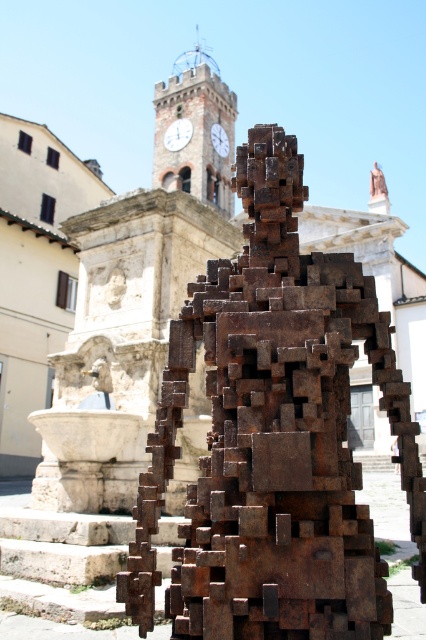
At what (x,y) coordinates should I click in order to perform the action: click on rusty metal sculpture at center. Please return your answer as a coordinate pair (x, y). Looking at the image, I should click on (273, 435).

Between point (423, 520) and point (166, 145), which one is positioned behind?

Point (166, 145)

Where is `rusty metal sculpture at center`? rusty metal sculpture at center is located at coordinates (273, 435).

Which is behind, point (190, 113) or point (212, 125)?

Point (190, 113)

Is rustic stone clock tower at upper center bigger than rustic metal clock at center?

Indeed, rustic stone clock tower at upper center has a larger size compared to rustic metal clock at center.

Is point (204, 196) positioned behind point (226, 136)?

No, (204, 196) is closer to viewer.

Identify the location of rustic stone clock tower at upper center. (193, 129).

Who is positioned more to the left, rusty metal sculpture at center or rustic stone clock tower at upper center?

rustic stone clock tower at upper center

Locate an element on the screen. This screenshot has height=640, width=426. rusty metal sculpture at center is located at coordinates (273, 435).